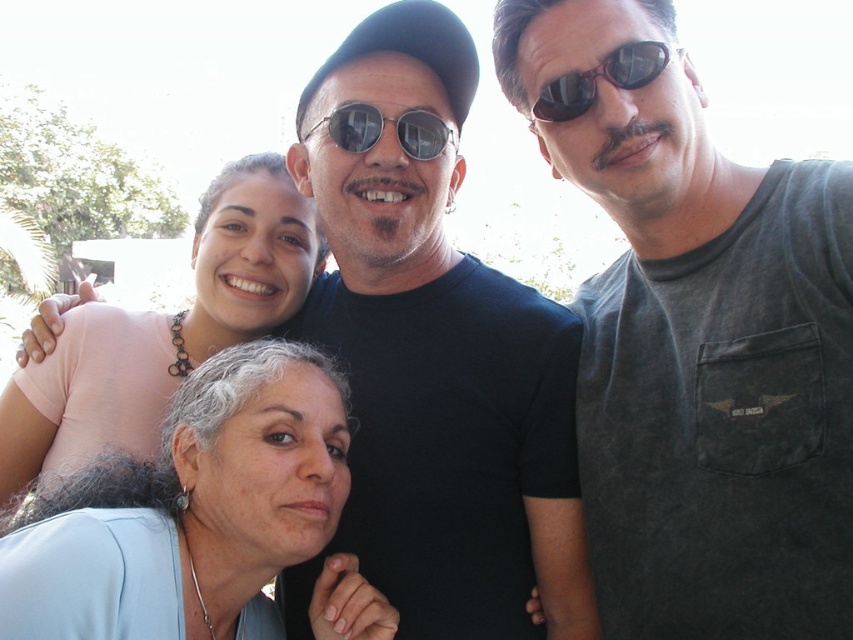
Is point (289, 371) positioned in front of point (573, 84)?

No, it is behind (573, 84).

The image size is (853, 640). What are the coordinates of `light blue fabric at lower left` in the screenshot? It's located at (189, 509).

Based on the photo, measure the distance between point (339,560) and camera.

They are 8.07 meters apart.

Where is `light blue fabric at lower left`? This screenshot has height=640, width=853. light blue fabric at lower left is located at coordinates (189, 509).

Find the location of a particular element. The width and height of the screenshot is (853, 640). light blue fabric at lower left is located at coordinates (189, 509).

Who is more forward, [137,612] or [412,134]?

Point [137,612]

The width and height of the screenshot is (853, 640). Identify the location of light blue fabric at lower left. (189, 509).

Can you confirm if gray cotton t-shirt at center is smaller than black matte t-shirt at upper center?

Actually, gray cotton t-shirt at center might be larger than black matte t-shirt at upper center.

Measure the distance between point (502, 52) and camera.

Point (502, 52) is 8.34 meters from camera.

Identify the location of gray cotton t-shirt at center. (695, 337).